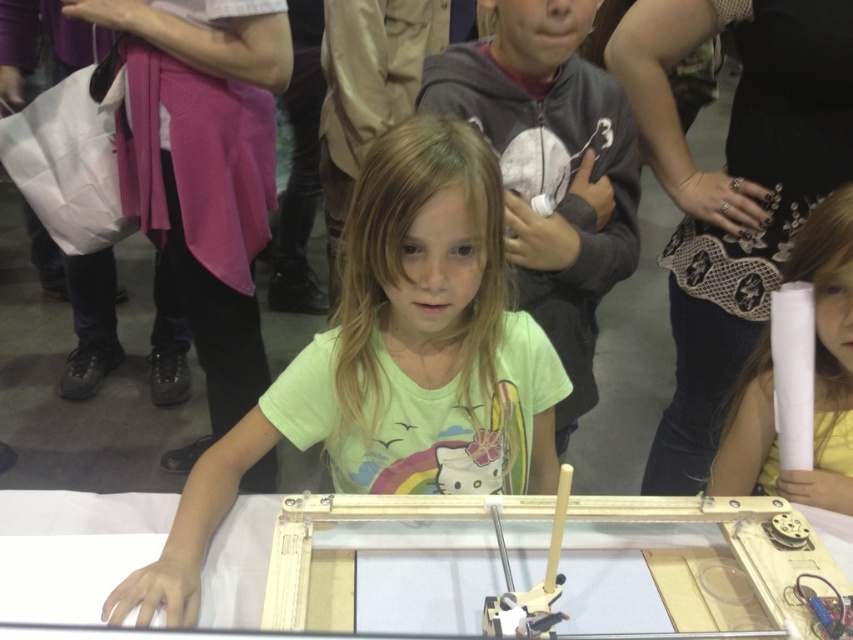
Question: Which object is farther from the camera taking this photo?

Choices:
 (A) light green t-shirt at center
 (B) smooth white paper at right

Answer: (B)

Question: Which of the following is the closest to the observer?

Choices:
 (A) smooth white paper at right
 (B) light green t-shirt at center

Answer: (B)

Question: Considering the relative positions of light green t-shirt at center and smooth white paper at right in the image provided, where is light green t-shirt at center located with respect to smooth white paper at right?

Choices:
 (A) below
 (B) above

Answer: (A)

Question: Which object appears farthest from the camera in this image?

Choices:
 (A) light green t-shirt at center
 (B) smooth white paper at right

Answer: (B)

Question: Does light green t-shirt at center have a smaller size compared to smooth white paper at right?

Choices:
 (A) no
 (B) yes

Answer: (A)

Question: Does light green t-shirt at center appear on the right side of smooth white paper at right?

Choices:
 (A) yes
 (B) no

Answer: (B)